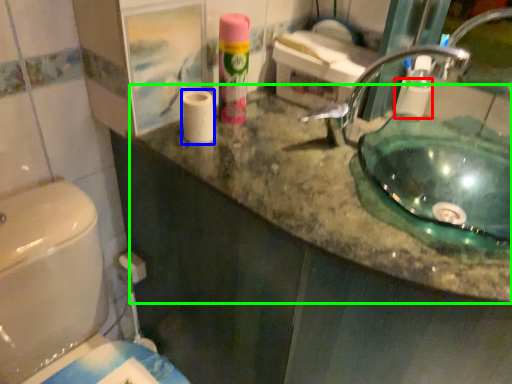
Question: Which object is positioned closest to toilet paper (highlighted by a red box)? Select from toilet paper (highlighted by a blue box) and counter top (highlighted by a green box).

Choices:
 (A) toilet paper
 (B) counter top

Answer: (B)